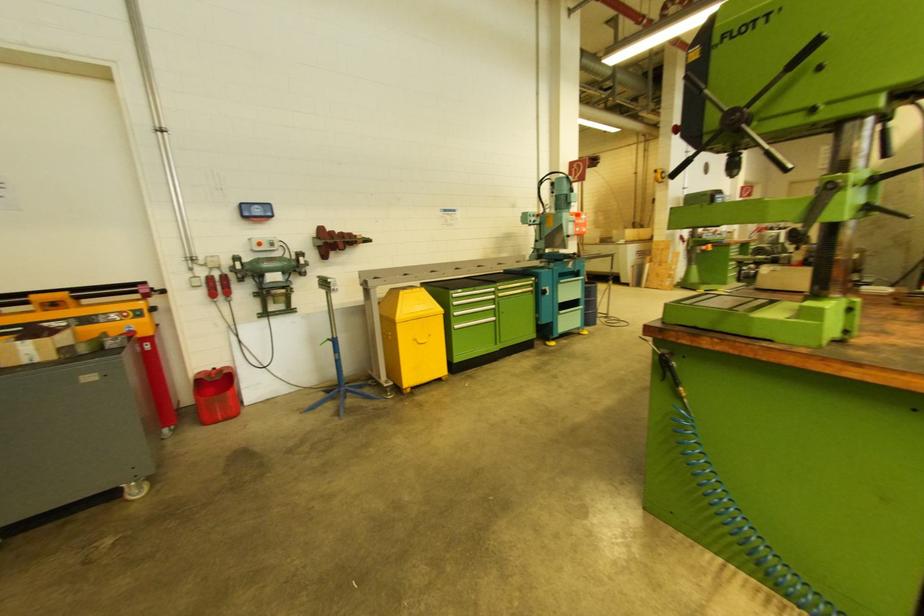
Identify the location of green power button. click(x=262, y=244).